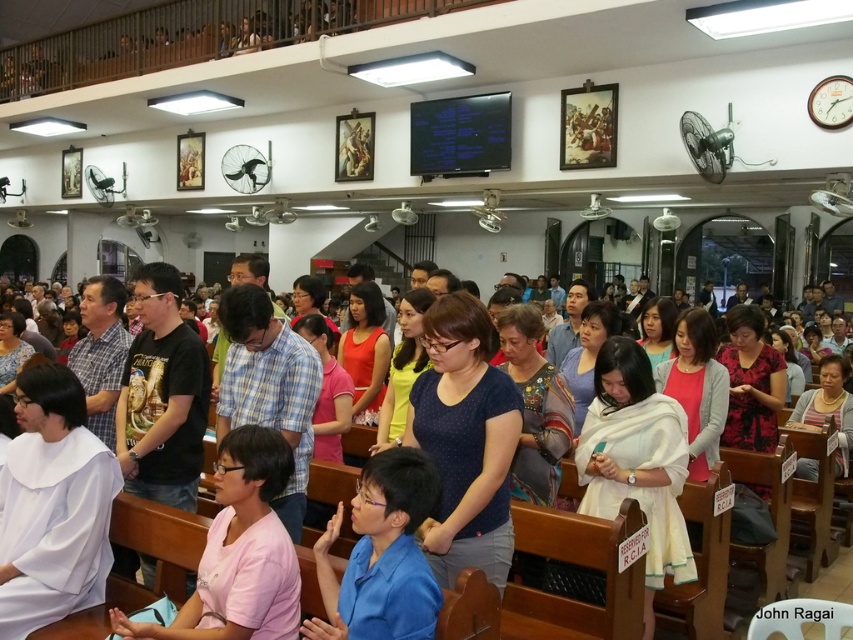
Consider the image. You are standing in the church and want to take a photo of the point at coordinates (408,602). If your camera has a focal length of 50mm and you are 7.16 feet away from the point, what is the approximate angle of view needed to capture the point in the center of your photo?

The point at coordinates (408,602) is 7.16 feet away from the camera. To calculate the angle of view, use the formula angle of view in degrees equals arctangent of object distance divided by focal length. Plugging in the values, the angle of view would be approximately 8 degrees.

You are a photographer trying to capture a group photo of the attendees in the church. You notice two people wearing a blue fabric shirt at center and a pink fabric shirt at center. Since you want to ensure both shirts are clearly visible in the photo, which shirt should you focus on to avoid blurring due to size differences?

The blue fabric shirt at center occupies less space than the pink fabric shirt at center, so you should focus on the pink fabric shirt at center to ensure both are in focus as it is larger and easier to capture clearly.

You are standing at the entrance of the church and see two people in the center wearing blue fabric shirt at center and pink fabric shirt at center. Which one is positioned to the right of the other?

The blue fabric shirt at center is positioned to the right of the pink fabric shirt at center.